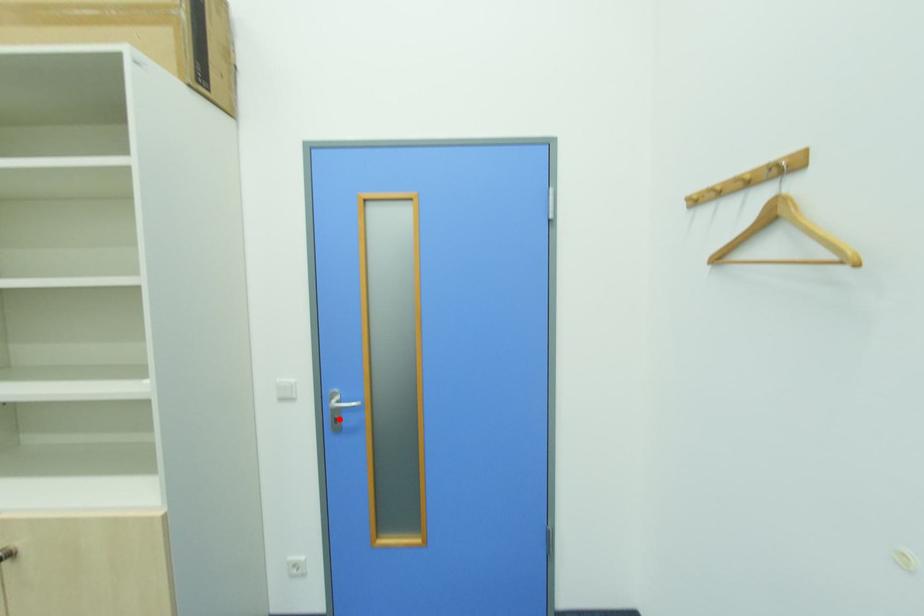
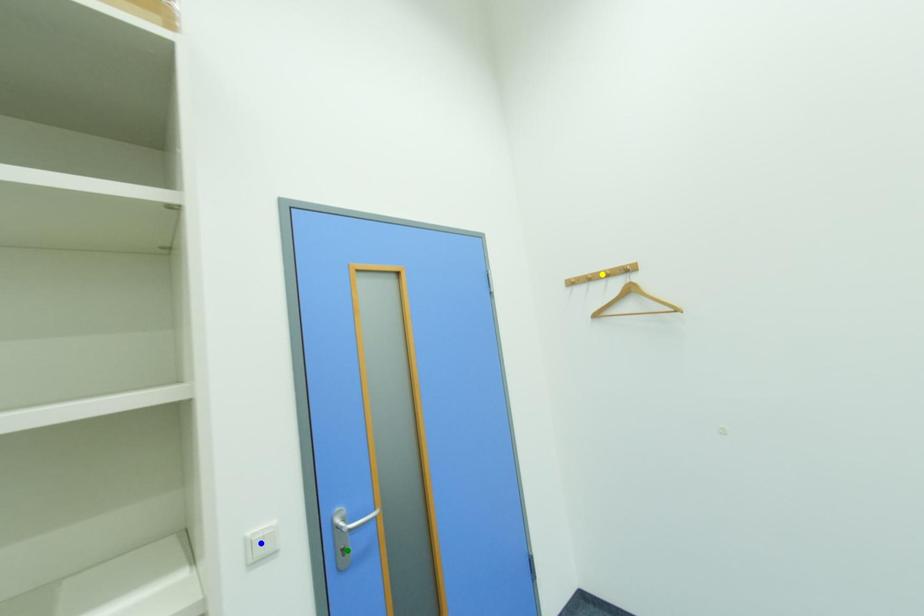
Question: I am providing you with two images of the same scene from different viewpoints. A red point is marked on the first image. You are given multiple points on the second image. Which mark in image 2 goes with the point in image 1?

Choices:
 (A) blue point
 (B) yellow point
 (C) green point

Answer: (C)